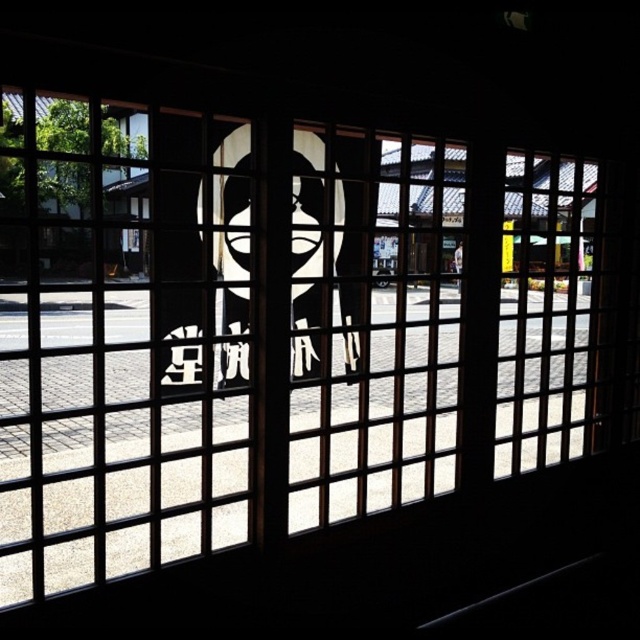
You are standing in a room with a transparent glass door at center and a wooden lattice door at right. You need to exit to the courtyard outside. Which door should you choose based on their height?

The transparent glass door at center is taller than the wooden lattice door at right, so you should choose the transparent glass door at center to exit since it is taller and likely provides better access to the courtyard.

Based on the photo, you are an interior designer planning to install a new door in a room with limited height. You have two options from the image, the translucent wood door at center and the wooden lattice door at right. Which door should you choose to ensure it fits within the height constraints?

The wooden lattice door at right is shorter than the translucent wood door at center, so you should choose the wooden lattice door at right to ensure it fits within the height constraints.